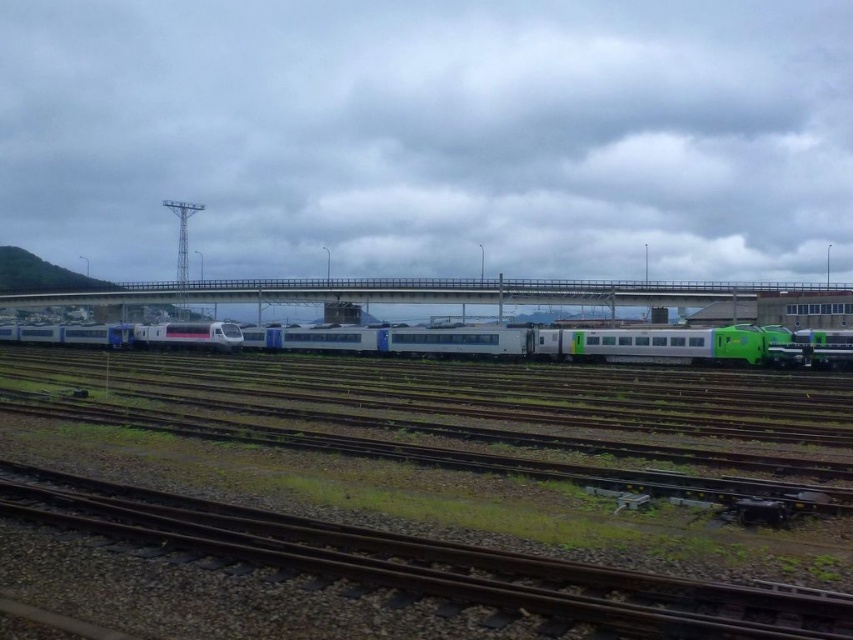
Question: Which of the following is the farthest from the observer?

Choices:
 (A) (338, 294)
 (B) (746, 348)

Answer: (A)

Question: Does brown gravel train track at lower center appear under white glossy train at center?

Choices:
 (A) yes
 (B) no

Answer: (A)

Question: Which object is the farthest from the concrete bridge at center?

Choices:
 (A) white glossy train at center
 (B) brown gravel train track at lower center

Answer: (B)

Question: Does white glossy train at center have a larger size compared to concrete bridge at center?

Choices:
 (A) yes
 (B) no

Answer: (B)

Question: Is the position of white glossy train at center more distant than that of concrete bridge at center?

Choices:
 (A) no
 (B) yes

Answer: (A)

Question: Among these points, which one is nearest to the camera?

Choices:
 (A) (45, 292)
 (B) (659, 356)

Answer: (B)